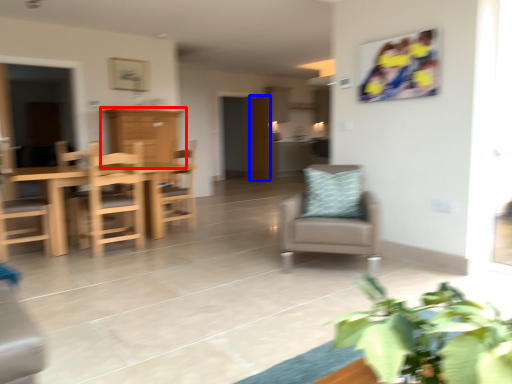
Question: Which object is further to the camera taking this photo, cabinetry (highlighted by a red box) or door (highlighted by a blue box)?

Choices:
 (A) cabinetry
 (B) door

Answer: (B)